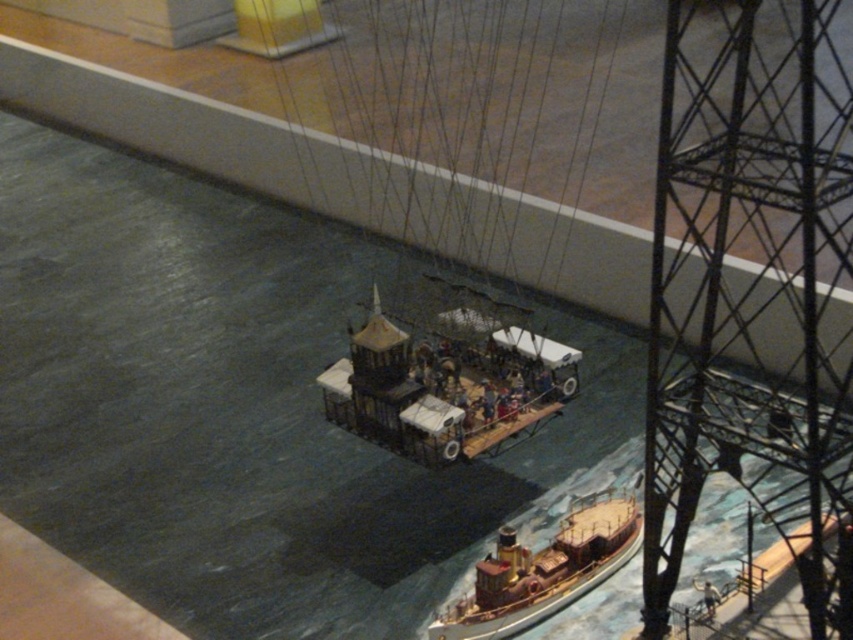
You are standing at the point with coordinates (445, 385). Which object is directly in front of you?

The wooden ship at center is located at point (445, 385), so that is the object directly in front of you.

You are a sailor on the wooden ship at center and want to signal to the wooden ship at lower right. Considering their heights, which ship has a better vantage point for visibility?

The wooden ship at center has a greater height compared to the wooden ship at lower right, so it has a better vantage point for visibility.

You are a photographer positioned at the camera. You want to capture a photo where both the point at point [399,358] and the point at point [531,614] are in focus. Which point should you focus on to ensure both are sharp?

You should focus on point [399,358] because it is closer to the camera than point [531,614]. By focusing on the closer point, the depth of field will extend backward, increasing the likelihood that both points are in focus.